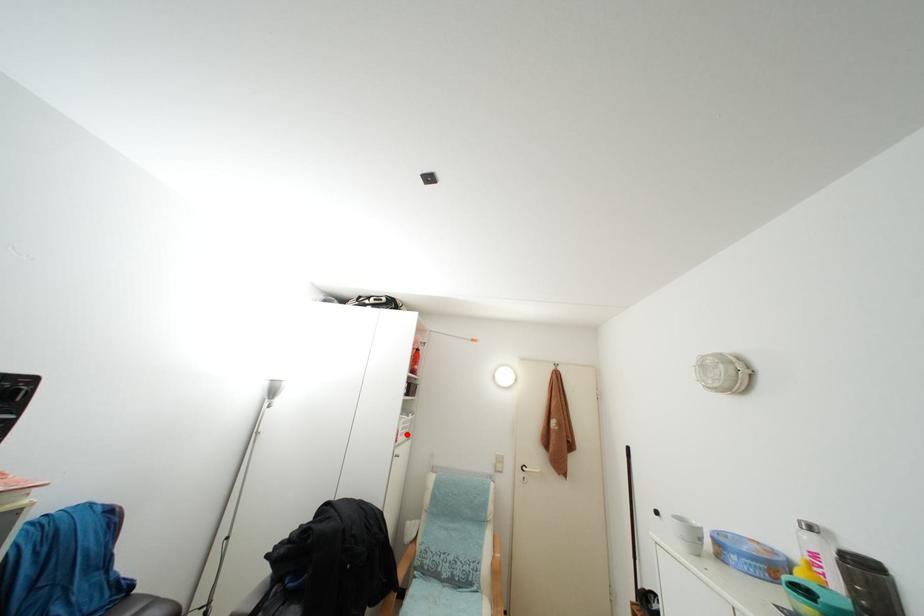
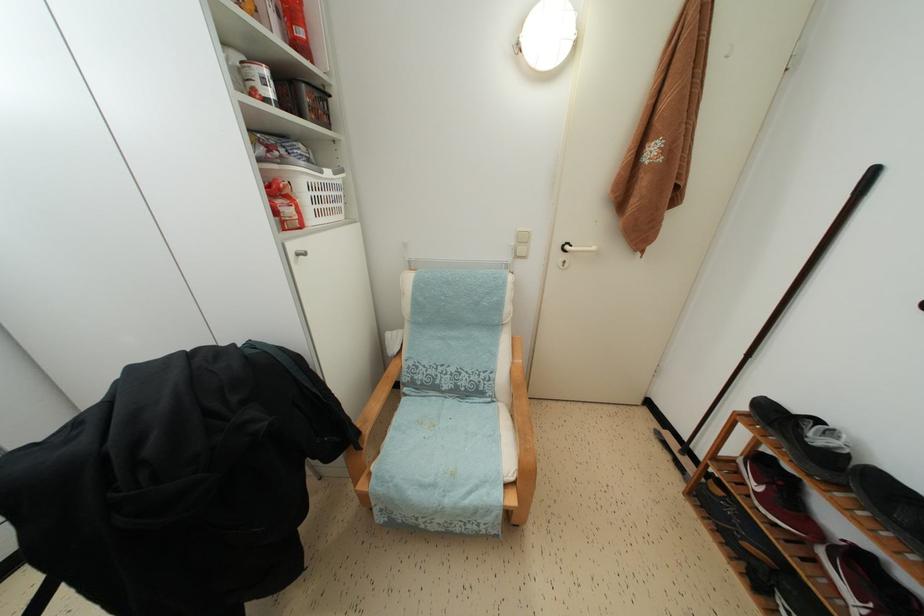
Question: I am providing you with two images of the same scene from different viewpoints. Image1 has a red point marked. In image2, the corresponding 3D location appears at what relative position? Reply with the corresponding letter.

Choices:
 (A) Closer
 (B) Farther

Answer: (A)